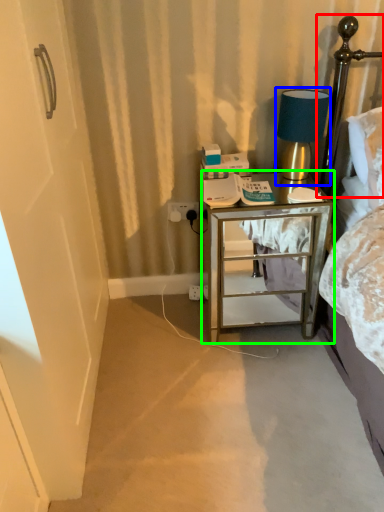
Question: Considering the real-world distances, which object is farthest from headboard (highlighted by a red box)? table lamp (highlighted by a blue box) or nightstand (highlighted by a green box)?

Choices:
 (A) table lamp
 (B) nightstand

Answer: (B)